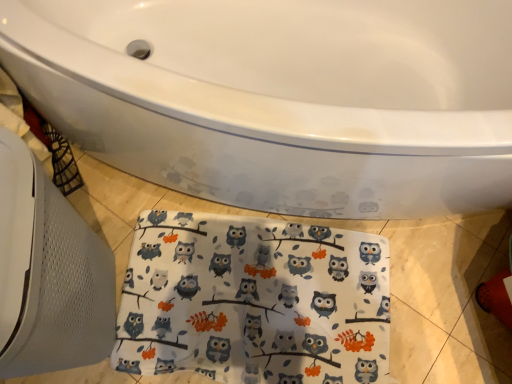
Where is `empty space that is ontop of white fabric with owl print at lower center (from a real-world perspective)`? The height and width of the screenshot is (384, 512). empty space that is ontop of white fabric with owl print at lower center (from a real-world perspective) is located at coordinates (263, 296).